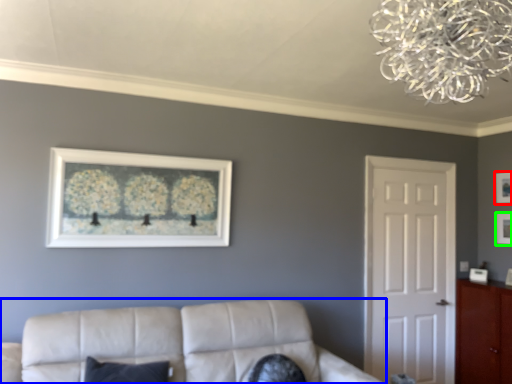
Question: Which is farther away from picture frame (highlighted by a red box)? studio couch (highlighted by a blue box) or picture frame (highlighted by a green box)?

Choices:
 (A) studio couch
 (B) picture frame

Answer: (A)